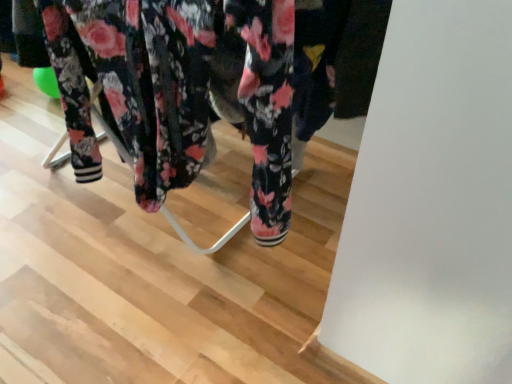
Where is `metallic white rack at center`? metallic white rack at center is located at coordinates (137, 84).

The width and height of the screenshot is (512, 384). Describe the element at coordinates (137, 84) in the screenshot. I see `metallic white rack at center` at that location.

I want to click on metallic white rack at center, so click(x=137, y=84).